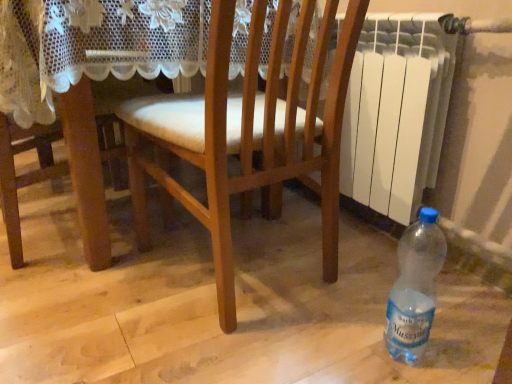
Image resolution: width=512 pixels, height=384 pixels. What are the coordinates of `free space in front of wooden chair at center` in the screenshot? It's located at (211, 347).